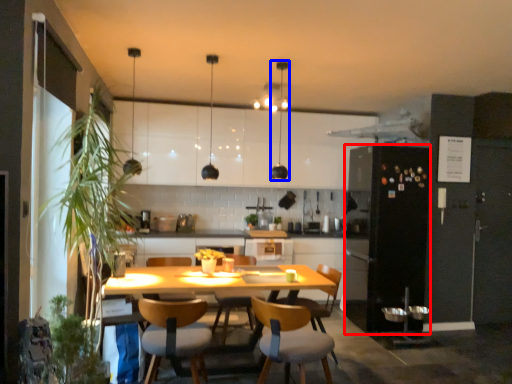
Question: Among these objects, which one is farthest to the camera, fridge (highlighted by a red box) or light fixture (highlighted by a blue box)?

Choices:
 (A) fridge
 (B) light fixture

Answer: (A)